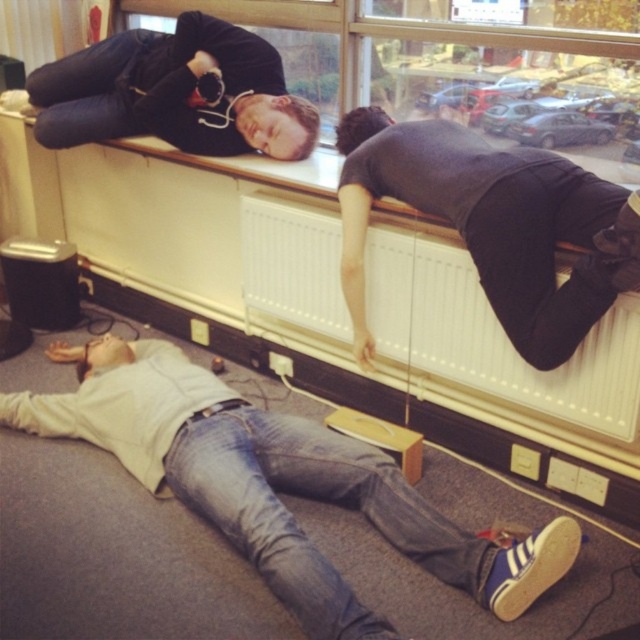
You are an office worker who wants to place a 15 cm tall paperweight on the surface between the white textured radiator at upper center and the matte black laptop at upper center. Can the surface accommodate the paperweight without it being too close to either object?

The white textured radiator at upper center is taller than the matte black laptop at upper center. Since the radiator is taller, it might cast a shadow over the surface, but the height difference does not affect the horizontal space. The surface between them can likely accommodate the paperweight as long as it is placed centrally and not too close to either object.

You are standing in the room and want to place a small potted plant on the floor near the white textured radiator at upper center. The radiator is located at coordinates point (492, 337). Considering the radiator is at this point, where should you place the plant relative to the person lying on the windowsill?

The white textured radiator at upper center is located at point (492, 337). To place the plant near the radiator, you should position it close to the upper center area of the room, which is above and slightly to the left of the person lying on the windowsill.

You are a photographer trying to capture a candid shot of the scene. You notice the white matte shirt at lower left and the matte black laptop at upper center. Which object is located to the right of the other?

The white matte shirt at lower left is positioned on the right side of matte black laptop at upper center, so the white matte shirt at lower left is to the right of the matte black laptop at upper center.